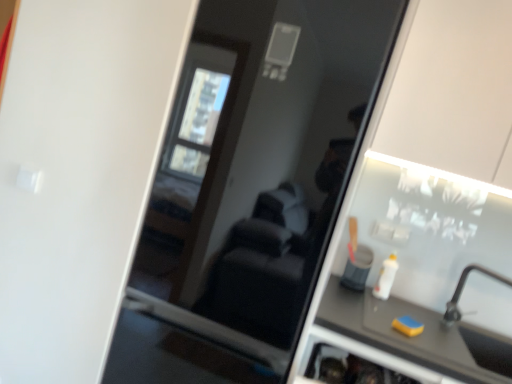
In order to click on free space to the left of yellow sponge at lower right in this screenshot , I will do `click(378, 316)`.